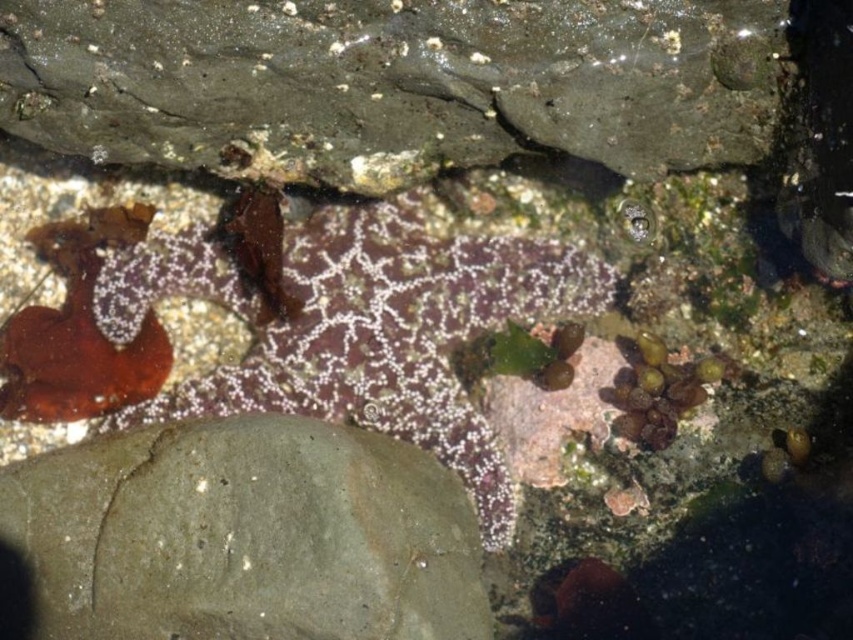
Does point (372, 134) come farther from viewer compared to point (132, 500)?

No.

Is smooth gray rock at upper center to the right of gray matte rock at center from the viewer's perspective?

Indeed, smooth gray rock at upper center is positioned on the right side of gray matte rock at center.

Is point (24, 33) less distant than point (167, 628)?

Yes, it is.

The width and height of the screenshot is (853, 640). I want to click on smooth gray rock at upper center, so click(x=392, y=83).